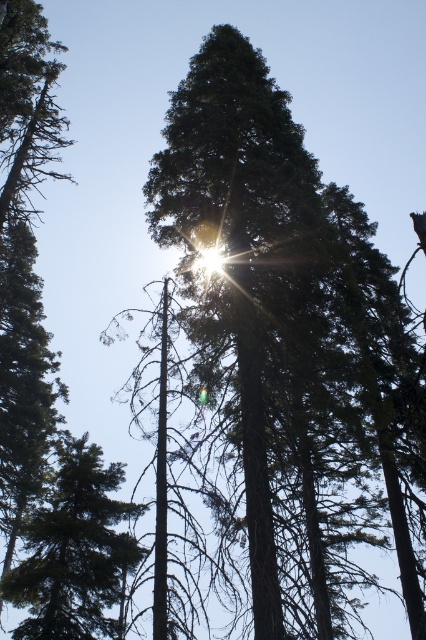
Is green matte tree at lower left to the right of green matte tree at upper left from the viewer's perspective?

Yes, green matte tree at lower left is to the right of green matte tree at upper left.

Who is more distant from viewer, (89, 595) or (42, 64)?

Positioned behind is point (42, 64).

This screenshot has width=426, height=640. I want to click on green matte tree at lower left, so click(74, 552).